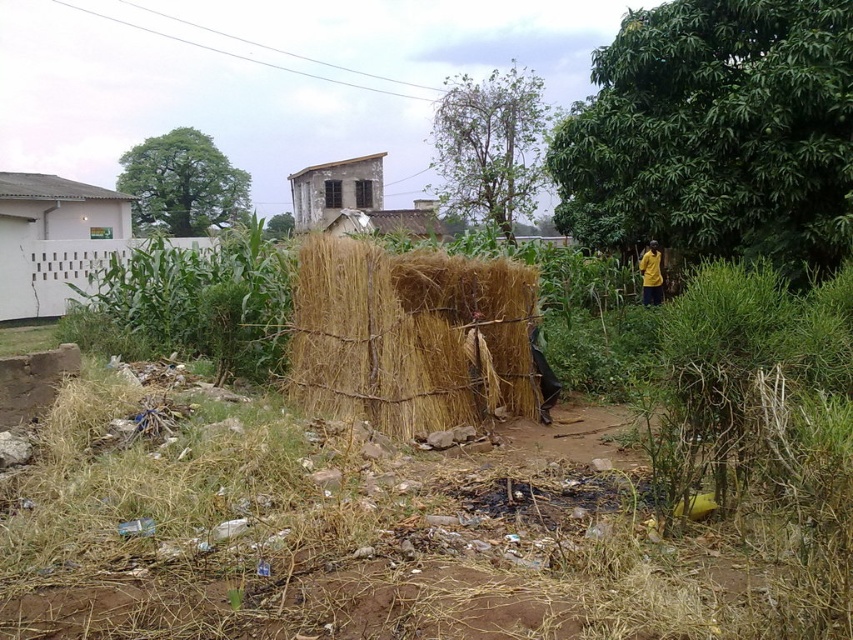
Question: Is the position of dry straw bale at center more distant than that of weathered wooden hut at center?

Choices:
 (A) no
 (B) yes

Answer: (A)

Question: Can you confirm if dry straw bale at center is positioned to the left of weathered wooden hut at center?

Choices:
 (A) yes
 (B) no

Answer: (B)

Question: Which point is farther to the camera?

Choices:
 (A) (381, 195)
 (B) (332, 237)
 (C) (39, 276)

Answer: (A)

Question: Which object appears farthest from the camera in this image?

Choices:
 (A) white lattice fence at upper left
 (B) weathered wooden hut at center
 (C) dry straw bale at center

Answer: (B)

Question: Is dry straw bale at center behind weathered wooden hut at center?

Choices:
 (A) no
 (B) yes

Answer: (A)

Question: Estimate the real-world distances between objects in this image. Which object is closer to the white lattice fence at upper left?

Choices:
 (A) weathered wooden hut at center
 (B) dry straw bale at center

Answer: (A)